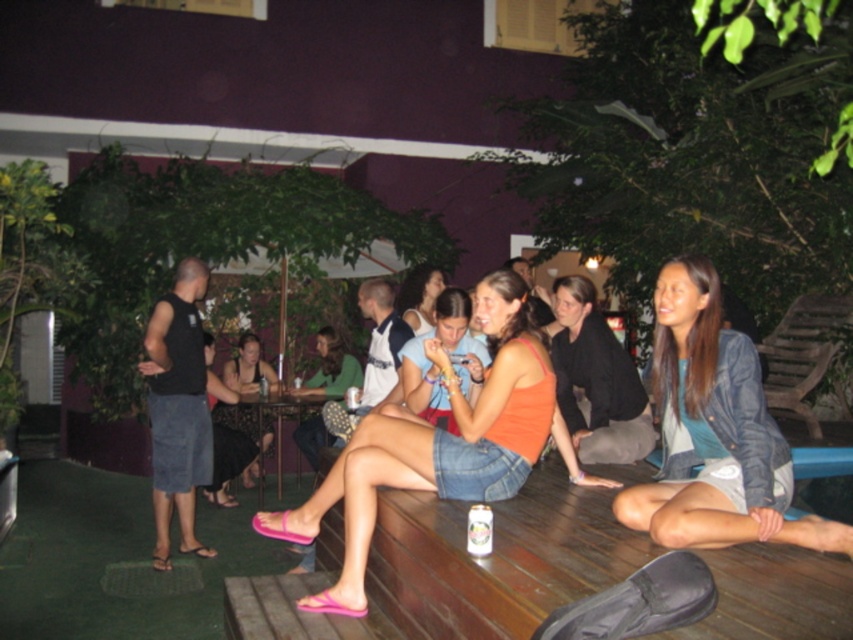
Who is more forward, (746, 381) or (445, 305)?

Positioned in front is point (746, 381).

Between point (770, 522) and point (483, 346), which one is positioned behind?

Point (483, 346)

Where is `denim jacket at lower right`? Image resolution: width=853 pixels, height=640 pixels. denim jacket at lower right is located at coordinates 714,432.

Does orange matte tank top at center have a lesser height compared to white paper can at lower center?

No, orange matte tank top at center is not shorter than white paper can at lower center.

This screenshot has height=640, width=853. What are the coordinates of `orange matte tank top at center` in the screenshot? It's located at (437, 365).

Where is `orange matte tank top at center`? This screenshot has height=640, width=853. orange matte tank top at center is located at coordinates (437, 365).

Is orange tank top at center below matte orange tank top at center?

Yes, orange tank top at center is below matte orange tank top at center.

Image resolution: width=853 pixels, height=640 pixels. What do you see at coordinates (331, 368) in the screenshot?
I see `orange tank top at center` at bounding box center [331, 368].

Locate an element on the screen. The width and height of the screenshot is (853, 640). orange tank top at center is located at coordinates (331, 368).